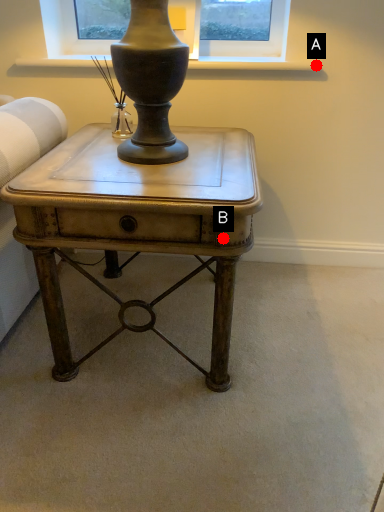
Question: Two points are circled on the image, labeled by A and B beside each circle. Which of the following is the farthest from the observer?

Choices:
 (A) A is further
 (B) B is further

Answer: (A)